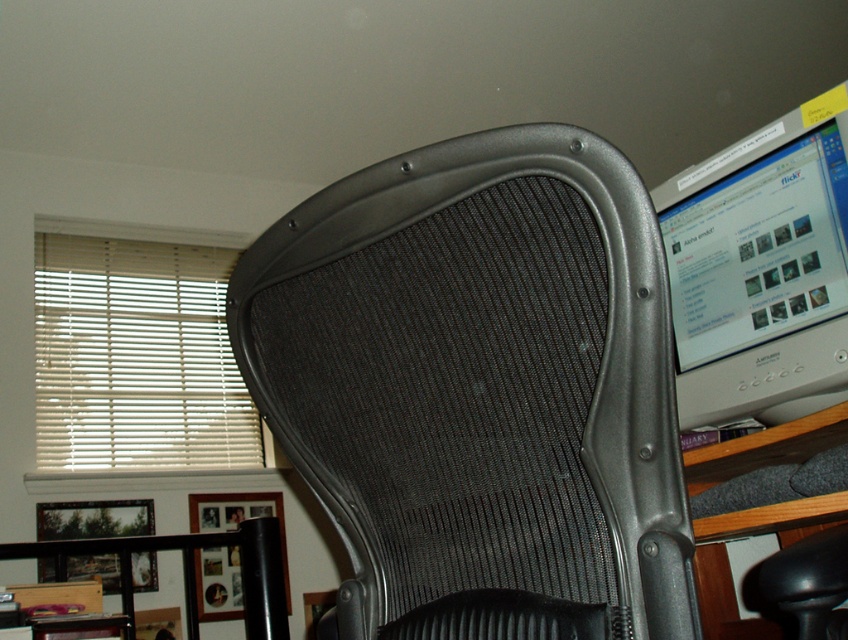
Question: Does silver metallic monitor at upper right appear on the right side of white/wooden blinds at left?

Choices:
 (A) yes
 (B) no

Answer: (A)

Question: Observing the image, what is the correct spatial positioning of silver metallic monitor at upper right in reference to white/wooden blinds at left?

Choices:
 (A) left
 (B) right

Answer: (B)

Question: Which object is farther from the camera taking this photo?

Choices:
 (A) silver metallic monitor at upper right
 (B) black mesh swivel chair at center
 (C) white/wooden blinds at left

Answer: (C)

Question: Is black mesh swivel chair at center smaller than white/wooden blinds at left?

Choices:
 (A) no
 (B) yes

Answer: (B)

Question: Which point is closer to the camera taking this photo?

Choices:
 (A) (790, 384)
 (B) (40, 426)

Answer: (A)

Question: Considering the real-world distances, which object is farthest from the silver metallic monitor at upper right?

Choices:
 (A) white/wooden blinds at left
 (B) black mesh swivel chair at center

Answer: (A)